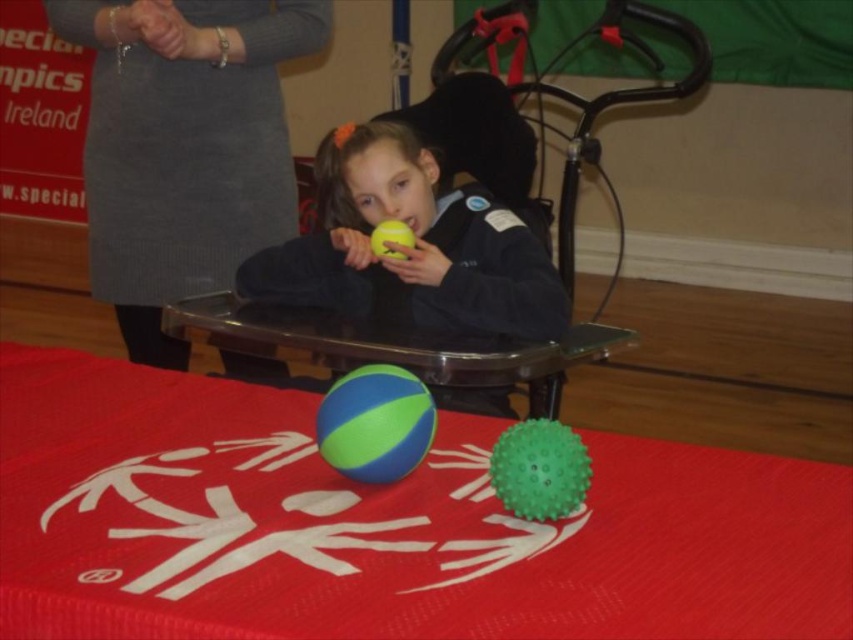
You are a parent at a childrens event and see the transparent plastic table at center and the green rubber beach ball at center. You want to place a snack plate on the table. Is there enough space between the table and the ball to do so?

The transparent plastic table at center is 10.80 inches from the green rubber beach ball at center. Since the distance is sufficient to place a snack plate, you can do so without the ball interfering.

You are a photographer setting up for a photo shoot in the gymnasium. You notice the gray woolen dress at upper left and the green rubber beach ball at center. Which object is covering the other?

The gray woolen dress at upper left is positioned over the green rubber beach ball at center, so it is covering the beach ball.

You are a parent trying to place a green rubber beach ball at center on the transparent plastic table at center. Will the ball fit on the table without hanging off the edges?

The transparent plastic table at center has a width larger than the green rubber beach ball at center, so the ball will fit without hanging off the edges.